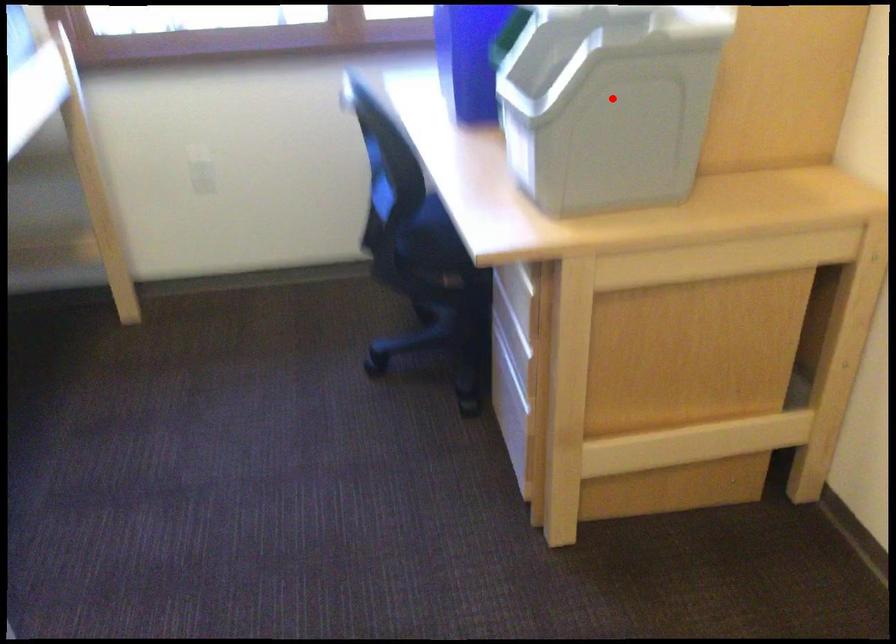
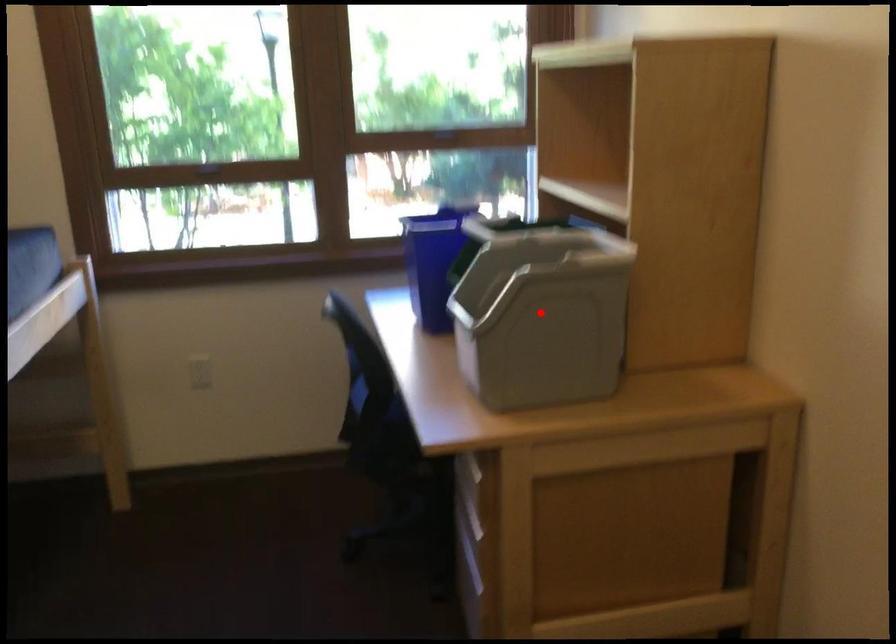
I am providing you with two images of the same scene from different viewpoints. A red point is marked on the first image and another point is marked on the second image. Does the point marked in image1 correspond to the same location as the one in image2?

Yes